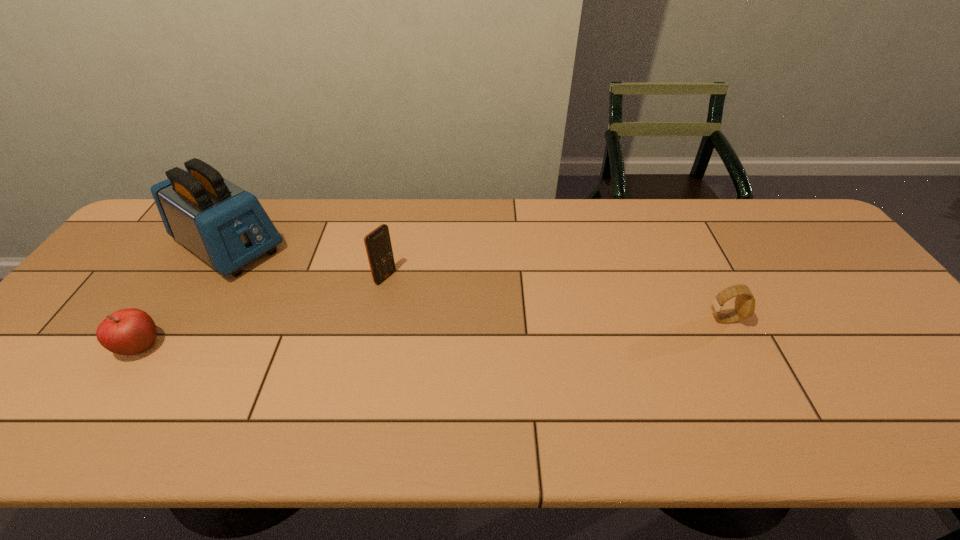
Where is `blank space at the far right corner of the desktop`? This screenshot has height=540, width=960. blank space at the far right corner of the desktop is located at coordinates (778, 234).

This screenshot has height=540, width=960. In order to click on free space between the rightmost object and the tallest object in this screenshot , I will do `click(476, 282)`.

Where is `empty space between the apple and the second object from right to left`? This screenshot has width=960, height=540. empty space between the apple and the second object from right to left is located at coordinates (263, 312).

Locate an element on the screen. empty space between the watch and the tallest object is located at coordinates (476, 282).

Locate an element on the screen. vacant point located between the tallest object and the apple is located at coordinates (185, 296).

What are the coordinates of `unoccupied position between the toaster and the watch` in the screenshot? It's located at (476, 282).

Image resolution: width=960 pixels, height=540 pixels. What are the coordinates of `blank region between the apple and the toaster` in the screenshot? It's located at (185, 296).

In order to click on vacant region between the apple and the tallest object in this screenshot , I will do `click(185, 296)`.

Where is `free point between the watch and the apple`? Image resolution: width=960 pixels, height=540 pixels. free point between the watch and the apple is located at coordinates (432, 333).

Where is `free space between the rightmost object and the toaster`? free space between the rightmost object and the toaster is located at coordinates (476, 282).